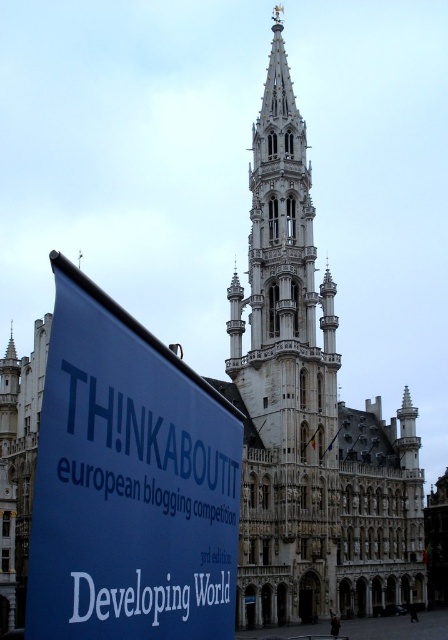
You are standing in front of the European Gothic building and want to take a photo of the white stone tower at center without the blue fabric banner at lower left blocking it. How should you position yourself?

Move to the right side of the blue fabric banner at lower left so that it is no longer between you and the white stone tower at center. Since the blue fabric banner at lower left is to the left of the white stone tower at center, moving right will allow you to see the tower unobstructed.

You are a tourist standing in front of the European Gothic building. You notice the blue fabric banner at lower left and the white stone tower at center. Which object is closer to the ground?

The blue fabric banner at lower left is positioned under the white stone tower at center, so it is closer to the ground.